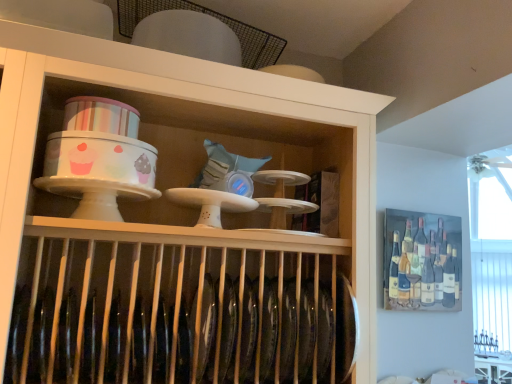
Describe the element at coordinates (493, 370) in the screenshot. Image resolution: width=512 pixels, height=384 pixels. I see `white glossy table at lower right` at that location.

Measure the distance between point (498,379) and camera.

They are 1.32 meters apart.

Image resolution: width=512 pixels, height=384 pixels. What do you see at coordinates (178, 98) in the screenshot?
I see `white glossy cake stand at upper center` at bounding box center [178, 98].

I want to click on painted wooden wine rack at upper right, so click(422, 261).

From the image's perspective, which is below, white glossy table at lower right or painted wooden wine rack at upper right?

white glossy table at lower right appears lower in the image.

Does white glossy table at lower right come behind painted wooden wine rack at upper right?

Yes, it is behind painted wooden wine rack at upper right.

In the scene shown: Is white glossy table at lower right touching painted wooden wine rack at upper right?

There is a gap between white glossy table at lower right and painted wooden wine rack at upper right.

Where is `cabinet that appears below the white glossy cake stand at upper center (from the image's perspective)`? This screenshot has height=384, width=512. cabinet that appears below the white glossy cake stand at upper center (from the image's perspective) is located at coordinates (422, 261).

What's the angular difference between white glossy cake stand at upper center and painted wooden wine rack at upper right's facing directions?

The angle between the facing direction of white glossy cake stand at upper center and the facing direction of painted wooden wine rack at upper right is 2.55 degrees.

Can you confirm if white glossy cake stand at upper center is taller than painted wooden wine rack at upper right?

Correct, white glossy cake stand at upper center is much taller as painted wooden wine rack at upper right.

Would you say white glossy cake stand at upper center is part of painted wooden wine rack at upper right's contents?

Definitely not — white glossy cake stand at upper center is not inside painted wooden wine rack at upper right.

Looking at this image, is painted wooden wine rack at upper right looking in the opposite direction of white glossy cake stand at upper center?

No, painted wooden wine rack at upper right is not facing away from white glossy cake stand at upper center.

From a real-world perspective, does painted wooden wine rack at upper right sit lower than white glossy cake stand at upper center?

Correct, in the physical world, painted wooden wine rack at upper right is lower than white glossy cake stand at upper center.

What's the angular difference between painted wooden wine rack at upper right and white glossy cake stand at upper center's facing directions?

They differ by 2.55 degrees in their facing directions.

How far apart are white glossy table at lower right and white glossy cake stand at upper center?

white glossy table at lower right and white glossy cake stand at upper center are 37.67 inches apart from each other.

Looking at their sizes, would you say white glossy table at lower right is wider or thinner than white glossy cake stand at upper center?

In the image, white glossy table at lower right appears to be wider than white glossy cake stand at upper center.

Does point (483, 368) come behind point (374, 261)?

That is True.

From a real-world perspective, does white glossy table at lower right stand above white glossy cake stand at upper center?

No.

Is white glossy table at lower right surrounded by white glossy cake stand at upper center?

Definitely not — white glossy table at lower right is not inside white glossy cake stand at upper center.

Is white glossy cake stand at upper center beside white glossy table at lower right?

There is a gap between white glossy cake stand at upper center and white glossy table at lower right.

Locate an element on the screen. The width and height of the screenshot is (512, 384). table located on the right of white glossy cake stand at upper center is located at coordinates (493, 370).

Considering the sizes of painted wooden wine rack at upper right and white glossy table at lower right in the image, is painted wooden wine rack at upper right wider or thinner than white glossy table at lower right?

painted wooden wine rack at upper right is thinner than white glossy table at lower right.

Consider the image. Is painted wooden wine rack at upper right aimed at white glossy table at lower right?

No, painted wooden wine rack at upper right is not oriented towards white glossy table at lower right.

Can you tell me how much painted wooden wine rack at upper right and white glossy table at lower right differ in facing direction?

The angular difference between painted wooden wine rack at upper right and white glossy table at lower right is 48.8 degrees.

Relative to white glossy table at lower right, is painted wooden wine rack at upper right in front or behind?

painted wooden wine rack at upper right is positioned closer to the viewer than white glossy table at lower right.

You are a GUI agent. You are given a task and a screenshot of the screen. Output one action in this format:
    pyautogui.click(x=<x>, y=<y>)
    Task: Click on the table that is under the painted wooden wine rack at upper right (from a real-world perspective)
    This screenshot has height=384, width=512.
    Given the screenshot: What is the action you would take?
    493,370

The width and height of the screenshot is (512, 384). In order to click on shelf in front of the painted wooden wine rack at upper right in this screenshot , I will do `click(178, 98)`.

Which object lies nearer to the anchor point white glossy cake stand at upper center, painted wooden wine rack at upper right or white glossy table at lower right?

painted wooden wine rack at upper right is closer to white glossy cake stand at upper center.

Estimate the real-world distances between objects in this image. Which object is closer to painted wooden wine rack at upper right, white glossy table at lower right or white glossy cake stand at upper center?

The object closer to painted wooden wine rack at upper right is white glossy table at lower right.

When comparing their distances from painted wooden wine rack at upper right, does white glossy cake stand at upper center or white glossy table at lower right seem further?

The object further to painted wooden wine rack at upper right is white glossy cake stand at upper center.

Considering their positions, is white glossy cake stand at upper center positioned further to white glossy table at lower right than painted wooden wine rack at upper right?

white glossy cake stand at upper center lies further to white glossy table at lower right than the other object.

Looking at the image, which one is located closer to white glossy table at lower right, painted wooden wine rack at upper right or white glossy cake stand at upper center?

Among the two, painted wooden wine rack at upper right is located nearer to white glossy table at lower right.

Which object lies further to the anchor point white glossy cake stand at upper center, white glossy table at lower right or painted wooden wine rack at upper right?

Among the two, white glossy table at lower right is located further to white glossy cake stand at upper center.

Find the location of a particular element. Image resolution: width=512 pixels, height=384 pixels. cabinet between white glossy cake stand at upper center and white glossy table at lower right in the front-back direction is located at coordinates (422, 261).